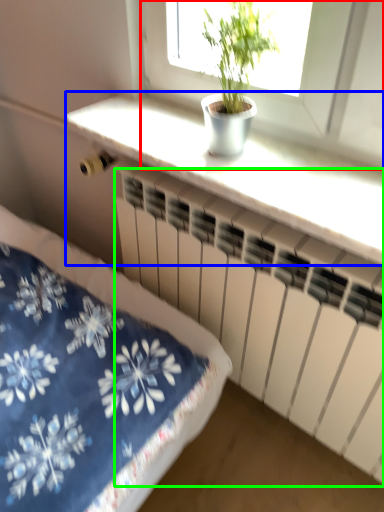
Question: Estimate the real-world distances between objects in this image. Which object is farther from window (highlighted by a red box), counter top (highlighted by a blue box) or radiator (highlighted by a green box)?

Choices:
 (A) counter top
 (B) radiator

Answer: (B)